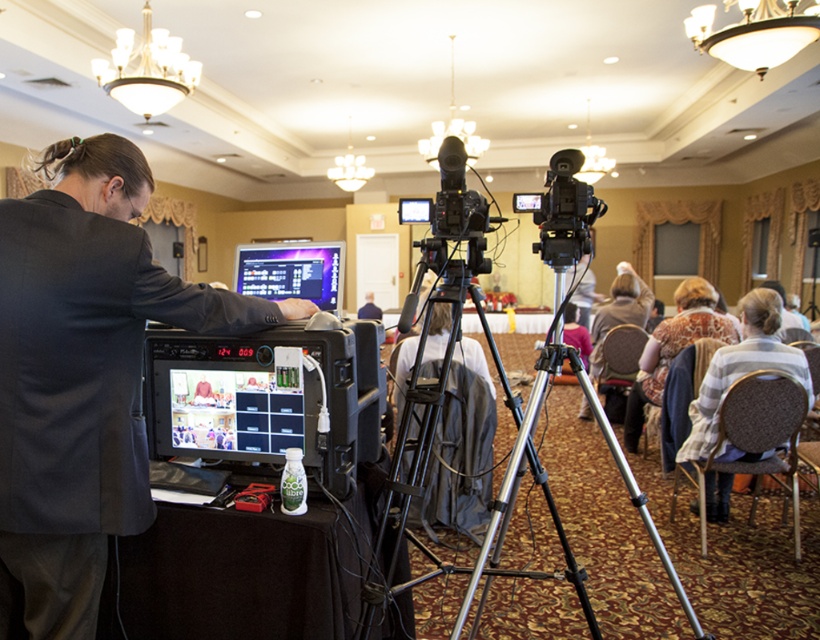
Who is more forward, (144, 99) or (370, 294)?

Point (144, 99)

Between white glass chandelier at upper center and blue fabric chair at center, which one is positioned lower?

Positioned lower is blue fabric chair at center.

Is point (157, 49) positioned behind point (367, 296)?

No, (157, 49) is closer to viewer.

Where is `white glass chandelier at upper center`? The height and width of the screenshot is (640, 820). white glass chandelier at upper center is located at coordinates pos(147,68).

Between brown fabric chair at lower right and white glass chandelier at upper center, which one has less height?

white glass chandelier at upper center

Who is positioned more to the left, brown fabric chair at lower right or white glass chandelier at upper center?

Positioned to the left is white glass chandelier at upper center.

Between point (700, 502) and point (181, 80), which one is positioned behind?

The point (181, 80) is behind.

Locate an element on the screen. The height and width of the screenshot is (640, 820). brown fabric chair at lower right is located at coordinates (758, 436).

Does silver metallic tripod at center have a lesser width compared to blue fabric chair at center?

No.

You are a GUI agent. You are given a task and a screenshot of the screen. Output one action in this format:
    pyautogui.click(x=<x>, y=<y>)
    Task: Click on the silver metallic tripod at center
    This screenshot has height=640, width=820.
    Given the screenshot: What is the action you would take?
    pyautogui.click(x=529, y=468)

Find the location of a particular element. Image resolution: width=820 pixels, height=640 pixels. silver metallic tripod at center is located at coordinates (529, 468).